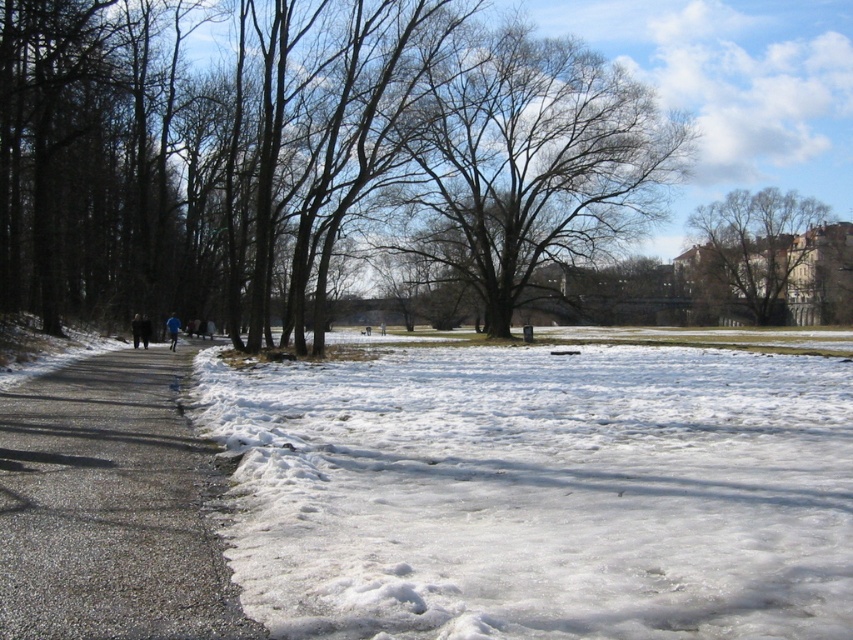
Between bare branches at center and green leafy tree at upper right, which one appears on the left side from the viewer's perspective?

bare branches at center is more to the left.

Where is `bare branches at center`? This screenshot has width=853, height=640. bare branches at center is located at coordinates (532, 163).

What do you see at coordinates (532, 163) in the screenshot? Image resolution: width=853 pixels, height=640 pixels. I see `bare branches at center` at bounding box center [532, 163].

I want to click on bare branches at center, so click(x=532, y=163).

Between asphalt road at left and bare branches at center, which one has more height?

bare branches at center is taller.

Which is in front, point (265, 636) or point (521, 88)?

Point (265, 636) is in front.

Measure the distance between asphalt road at left and camera.

asphalt road at left is 4.47 meters from camera.

Image resolution: width=853 pixels, height=640 pixels. Identify the location of asphalt road at left. (109, 506).

Is green leafy tree at upper right behind dark blue jacket at left?

Yes, green leafy tree at upper right is further from the viewer.

Which is in front, point (767, 298) or point (165, 323)?

Point (165, 323) is more forward.

At what (x,y) coordinates should I click in order to perform the action: click on green leafy tree at upper right. Please return your answer as a coordinate pair (x, y). Looking at the image, I should click on (757, 241).